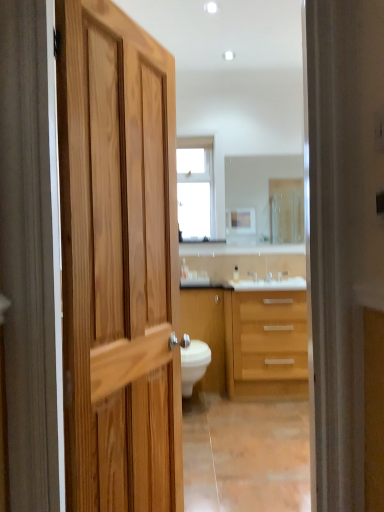
Question: Looking at their shapes, would you say matte wood cabinet at center is wider or thinner than satin nickel faucet at center?

Choices:
 (A) wide
 (B) thin

Answer: (A)

Question: Looking at the image, does matte wood cabinet at center seem bigger or smaller compared to satin nickel faucet at center?

Choices:
 (A) small
 (B) big

Answer: (B)

Question: Based on their relative distances, which object is nearer to the light wood cabinet at center?

Choices:
 (A) matte wood cabinet at center
 (B) clear glass window at upper center
 (C) satin nickel faucet at center
 (D) clear glass mirror at center

Answer: (A)

Question: Considering the real-world distances, which object is farthest from the light wood cabinet at center?

Choices:
 (A) clear glass window at upper center
 (B) clear glass mirror at center
 (C) matte wood cabinet at center
 (D) satin nickel faucet at center

Answer: (A)